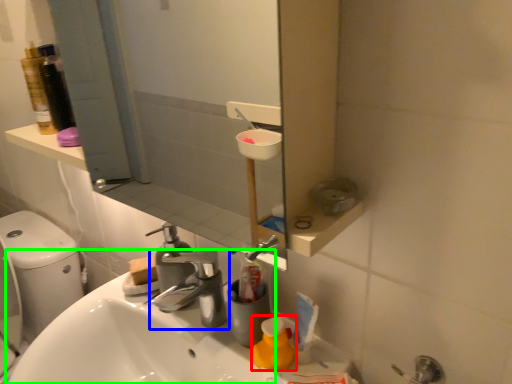
Question: Estimate the real-world distances between objects in this image. Which object is farther from cleaning product (highlighted by a red box), tap (highlighted by a blue box) or sink (highlighted by a green box)?

Choices:
 (A) tap
 (B) sink

Answer: (B)